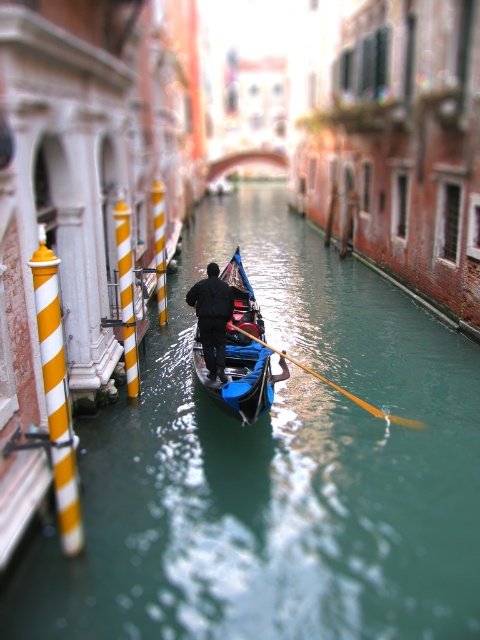
You are standing on a bridge overlooking the canal. You see the shiny blue gondola at center and the black matte jacket at center. Which object is positioned to the right side from your viewpoint?

The shiny blue gondola at center is to the right of the black matte jacket at center from your viewpoint.

You are a tourist standing on a bridge overlooking the canal. You see the green glossy water at center and the shiny blue gondola at center. Which object is closer to you?

The green glossy water at center is closer to you than the shiny blue gondola at center.

You are standing on the gondola and looking at two points in the scene. The first point is at coordinates point (358, 278) and the second is at point (201, 330). Which point is closer to you?

Point (358, 278) is further to the viewer than point (201, 330), so the second point is closer to you.